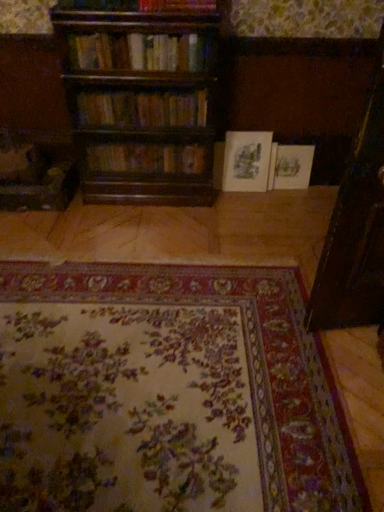
Locate an element on the screen. The width and height of the screenshot is (384, 512). vacant area that is in front of matte paper book at center, the fourth book viewed from the front is located at coordinates (253, 201).